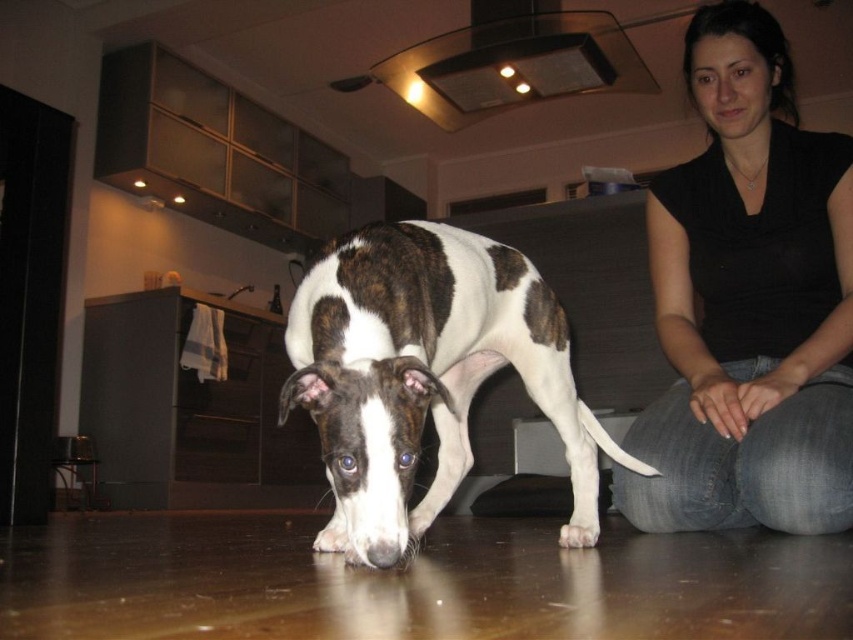
Question: Which point is farther to the camera?

Choices:
 (A) black cotton shirt at upper right
 (B) white fur paw at lower center
 (C) brown and white fur at center

Answer: (A)

Question: Where is black cotton shirt at upper right located in relation to white fur paw at lower center in the image?

Choices:
 (A) below
 (B) above

Answer: (B)

Question: Which point is farther to the camera?

Choices:
 (A) tap(558, 538)
 (B) tap(791, 156)

Answer: (B)

Question: Does black cotton shirt at upper right have a lesser width compared to white fur paw at lower center?

Choices:
 (A) yes
 (B) no

Answer: (B)

Question: Where is black cotton shirt at upper right located in relation to white fur paw at lower center in the image?

Choices:
 (A) right
 (B) left

Answer: (A)

Question: Which is nearer to the brown and white fur at center?

Choices:
 (A) black cotton shirt at upper right
 (B) white fur paw at lower center

Answer: (B)